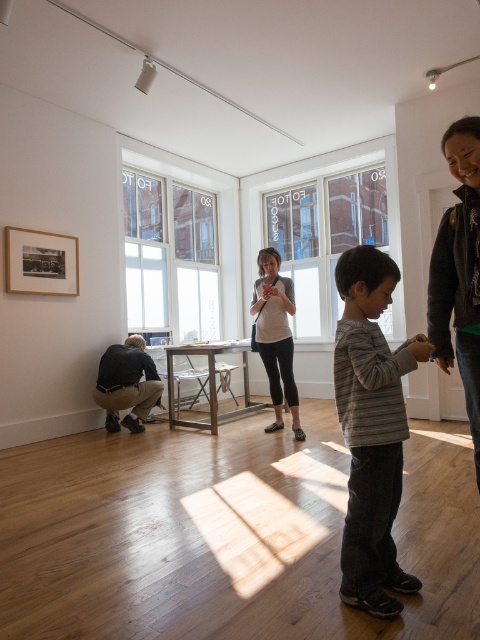
You are trying to decide whether to place a new plant pot between the dark gray fabric pants at lower left and the wooden picture frame at upper left. Which object is wider so that the plant pot can fit better next to it?

The dark gray fabric pants at lower left might be wider than wooden picture frame at upper left, so placing the plant pot next to the dark gray fabric pants at lower left would provide more space.